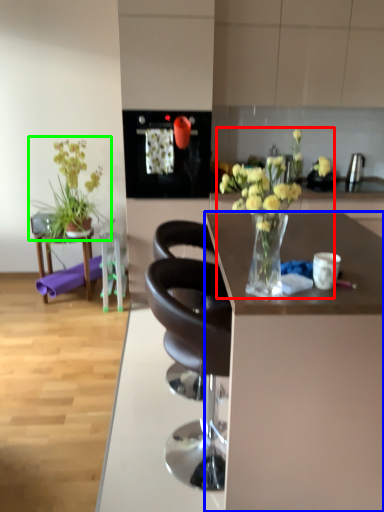
Question: Considering the real-world distances, which object is farthest from floral arrangement (highlighted by a red box)? desk (highlighted by a blue box) or houseplant (highlighted by a green box)?

Choices:
 (A) desk
 (B) houseplant

Answer: (B)